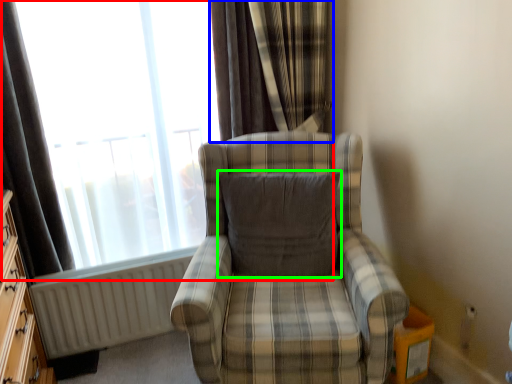
Question: Which is farther away from window (highlighted by a red box)? curtain (highlighted by a blue box) or pillow (highlighted by a green box)?

Choices:
 (A) curtain
 (B) pillow

Answer: (B)